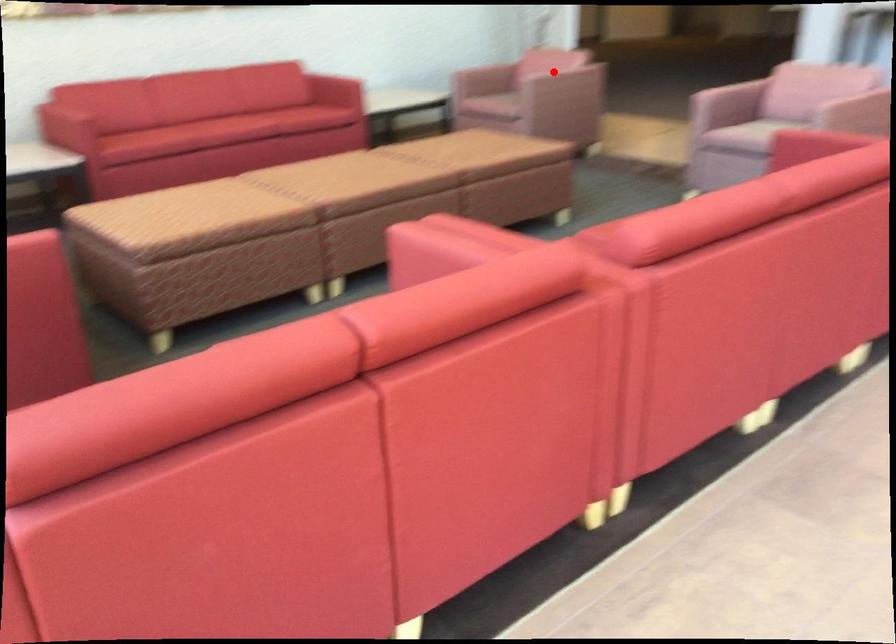
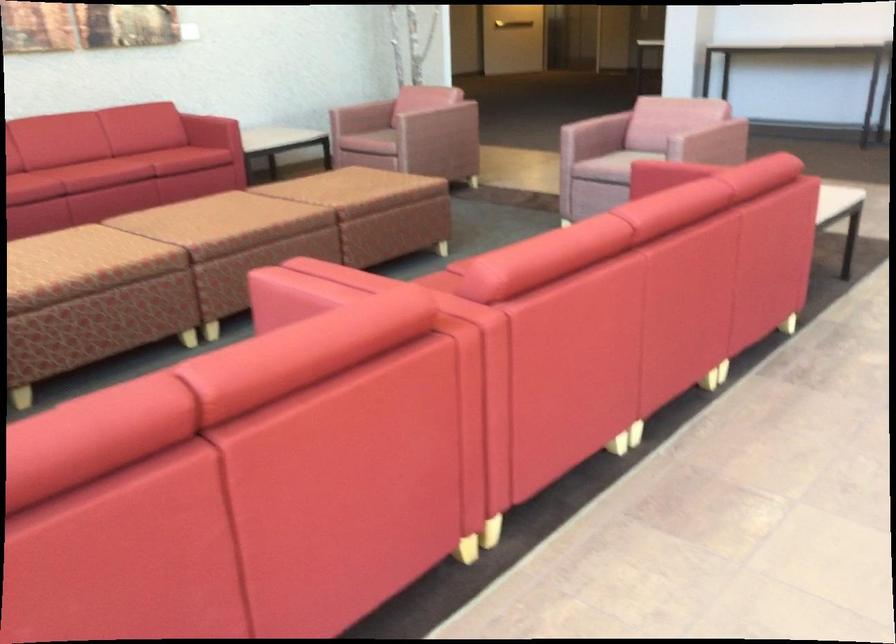
Where in the second image is the point corresponding to the highlighted location from the first image?

(431, 106)